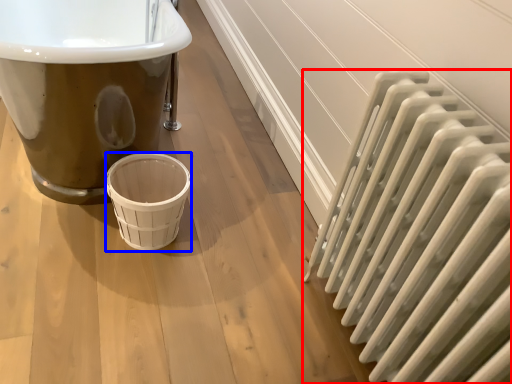
Question: Which object is further to the camera taking this photo, radiator (highlighted by a red box) or basket (highlighted by a blue box)?

Choices:
 (A) radiator
 (B) basket

Answer: (B)